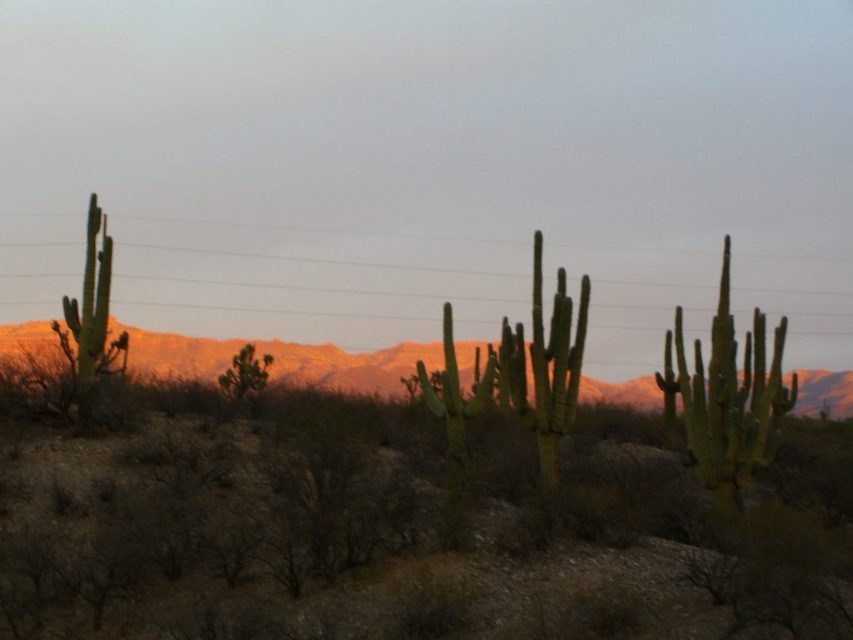
Question: Considering the relative positions of rustic sandstone mountains at center and green spiny cactus at left in the image provided, where is rustic sandstone mountains at center located with respect to green spiny cactus at left?

Choices:
 (A) right
 (B) left

Answer: (A)

Question: Observing the image, what is the correct spatial positioning of rustic sandstone mountains at center in reference to green spiny cactus at right?

Choices:
 (A) below
 (B) above

Answer: (A)

Question: Which object is farther from the camera taking this photo?

Choices:
 (A) rustic sandstone mountains at center
 (B) green spiny cactus at left

Answer: (B)

Question: Which point is closer to the camera taking this photo?

Choices:
 (A) (656, 406)
 (B) (720, 330)

Answer: (B)

Question: Considering the real-world distances, which object is farthest from the rustic sandstone mountains at center?

Choices:
 (A) green spiny cactus at right
 (B) green spiny cactus at left

Answer: (B)

Question: Can you confirm if rustic sandstone mountains at center is bigger than green spiny cactus at left?

Choices:
 (A) no
 (B) yes

Answer: (B)